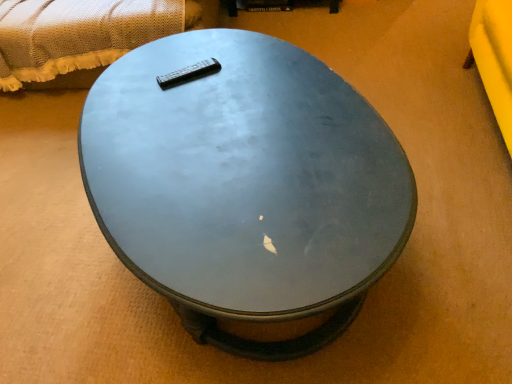
This screenshot has height=384, width=512. Find the location of `free space to the left of matte black table at center`. free space to the left of matte black table at center is located at coordinates (56, 230).